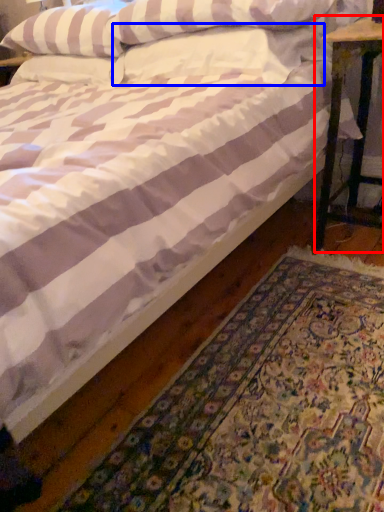
Question: Which object is further to the camera taking this photo, table (highlighted by a red box) or pillow (highlighted by a blue box)?

Choices:
 (A) table
 (B) pillow

Answer: (A)